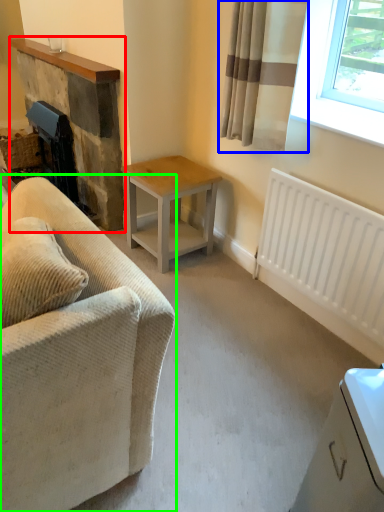
Question: Which is farther away from fireplace (highlighted by a red box)? curtain (highlighted by a blue box) or studio couch (highlighted by a green box)?

Choices:
 (A) curtain
 (B) studio couch

Answer: (B)